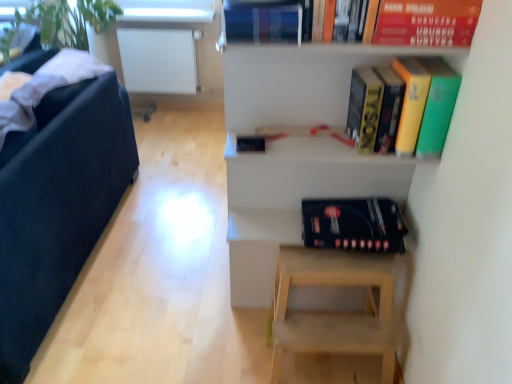
Find the location of a particular element. blank space situated above black matte album at lower center (from a real-world perspective) is located at coordinates (349, 204).